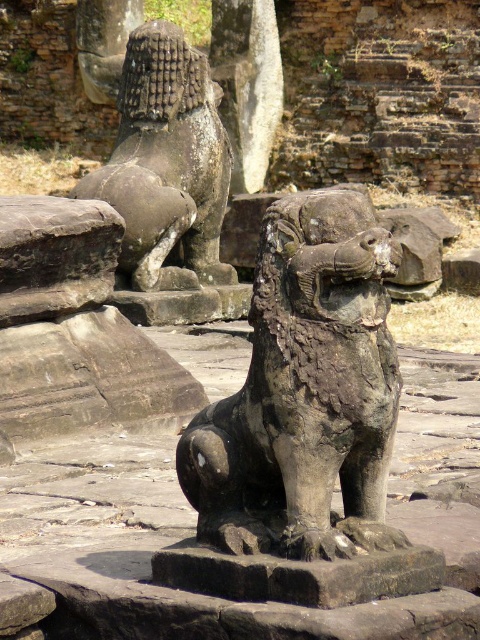
You are an archaeologist examining the ancient stone sculptures. You notice a point marked at coordinates [304,392]. Which sculpture does this point correspond to?

The point at [304,392] corresponds to the stone textured lion at center.

You are standing in front of the ancient stone sculptures. There are two points marked on the image at coordinates point (194, 426) and point (178, 93). Which point is nearer to you?

Point (194, 426) is closer to the viewer than point (178, 93).